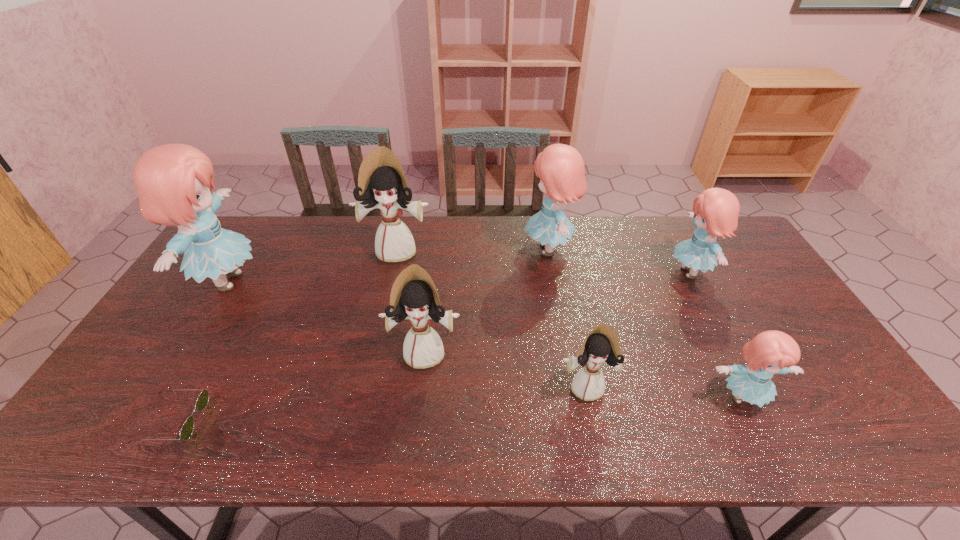
Locate an element on the screen. This screenshot has width=960, height=540. free spot at the near edge of the desktop is located at coordinates (608, 422).

Find the location of a particular element. The height and width of the screenshot is (540, 960). free space at the left edge of the desktop is located at coordinates (161, 367).

At what (x,y) coordinates should I click in order to perform the action: click on free space at the right edge of the desktop. Please return your answer as a coordinate pair (x, y). This screenshot has width=960, height=540. Looking at the image, I should click on pos(852,409).

I want to click on free space at the near right corner of the desktop, so click(x=820, y=433).

Where is `blank region between the third biggest blue doll and the farthest black doll`? blank region between the third biggest blue doll and the farthest black doll is located at coordinates (543, 261).

The width and height of the screenshot is (960, 540). Find the location of `unoccupied area between the second smallest blue doll and the second biggest black doll`. unoccupied area between the second smallest blue doll and the second biggest black doll is located at coordinates (558, 312).

You are a GUI agent. You are given a task and a screenshot of the screen. Output one action in this format:
    pyautogui.click(x=<x>, y=<y>)
    Task: Click on the unoccupied position between the second biggest blue doll and the leftmost blue doll
    
    Given the screenshot: What is the action you would take?
    pyautogui.click(x=388, y=265)

This screenshot has height=540, width=960. Identify the location of vacant area that lies between the second smallest black doll and the third biggest blue doll. (558, 312).

Identify the location of blank region between the third biggest blue doll and the nearest blue doll. This screenshot has width=960, height=540. (716, 335).

Identify the location of vacant space in between the second biggest blue doll and the green sunglasses. The image size is (960, 540). (361, 334).